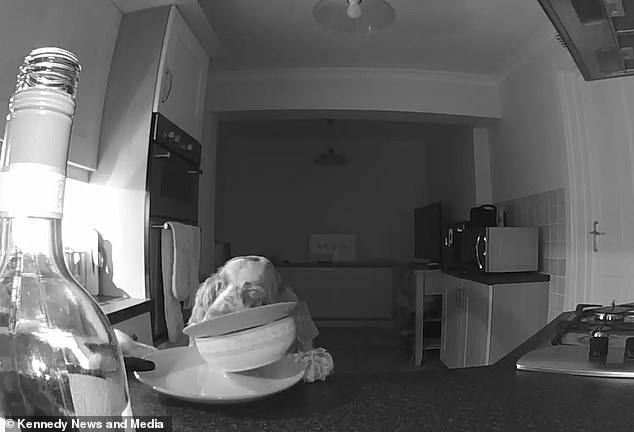
Locate an element on the screen. The image size is (634, 432). corners of microwave side is located at coordinates (489, 271), (539, 266), (538, 227), (486, 226).